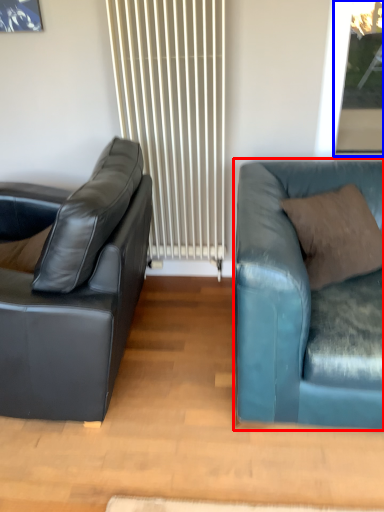
Question: Which of the following is the closest to the observer, studio couch (highlighted by a red box) or window screen (highlighted by a blue box)?

Choices:
 (A) studio couch
 (B) window screen

Answer: (A)